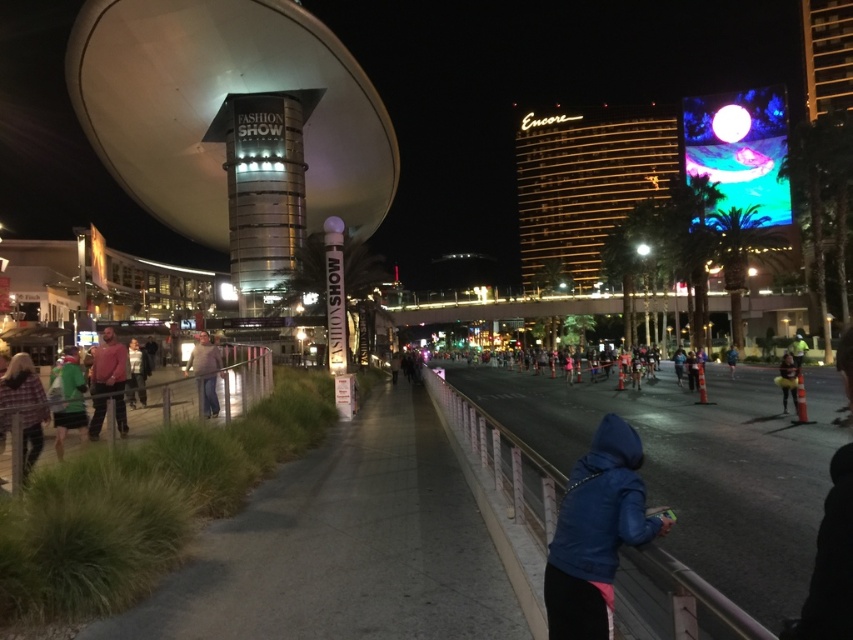
You are a photographer standing on the walkway in the scene. You want to take a photo of the light brown leather jacket at center without the plaid shirt at lower left blocking it. What should you do?

Move to a position where the plaid shirt at lower left is no longer between you and the light brown leather jacket at center, since the plaid shirt at lower left is in front of the light brown leather jacket at center.

You are standing at the center of the image and want to locate the plaid shirt at lower left. In which direction should you look to find it?

The plaid shirt at lower left is located at the lower left direction from your current position at the center of the image.

You are standing on the walkway in the scene and want to pick up both the blue matte jacket at lower right and the striped sweater at left. Which item should you reach for first if you want to grab the one closer to you?

The blue matte jacket at lower right is above the striped sweater at left, so it is closer to you. Reach for the blue matte jacket at lower right first.